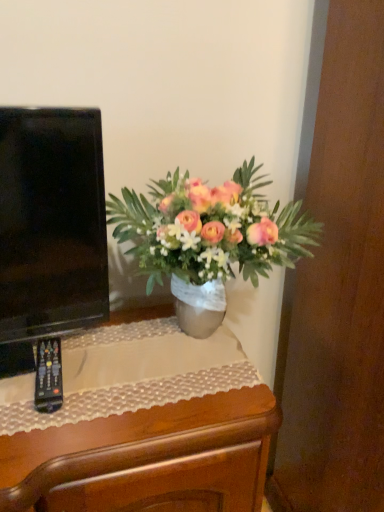
Question: From the image's perspective, is black plastic remote at lower left located above or below wooden desk at center?

Choices:
 (A) above
 (B) below

Answer: (A)

Question: Considering the positions of black plastic remote at lower left and wooden desk at center in the image, is black plastic remote at lower left wider or thinner than wooden desk at center?

Choices:
 (A) wide
 (B) thin

Answer: (B)

Question: Based on their relative distances, which object is farther from the black plastic remote at lower left?

Choices:
 (A) metallic silver vase at center
 (B) wooden desk at center

Answer: (A)

Question: Which of these objects is positioned farthest from the black plastic remote at lower left?

Choices:
 (A) wooden desk at center
 (B) metallic silver vase at center

Answer: (B)